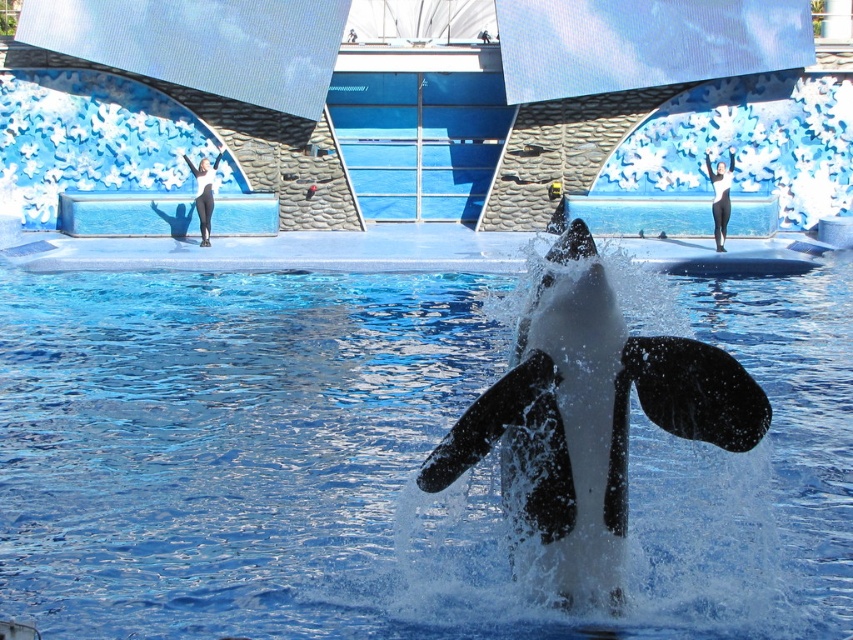
You are a visitor at the marine park and want to take a photo of the black smooth whale at center and the clear blue water at center. Based on their positions, which object should you focus on first to ensure both are in frame?

Since the clear blue water at center is to the right of the black smooth whale at center, you should focus on the black smooth whale at center first as it is on the left, ensuring both are within the frame when centered.

Based on the coordinates provided, what is located at point (387, 460) in the image?

The point (387, 460) corresponds to clear blue water at center.